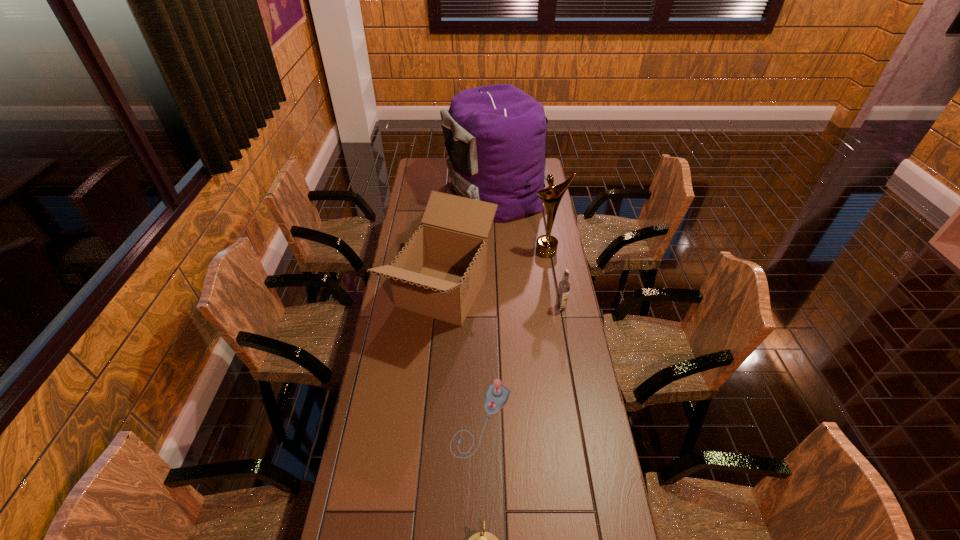
The height and width of the screenshot is (540, 960). Find the location of `object identified as the fifth closest to the fourth tallest object`. object identified as the fifth closest to the fourth tallest object is located at coordinates (484, 539).

Locate which object is the third closest to the award. Please provide its 2D coordinates. Your answer should be formatted as a tuple, i.e. [(x, y)], where the tuple contains the x and y coordinates of a point satisfying the conditions above.

[(564, 286)]